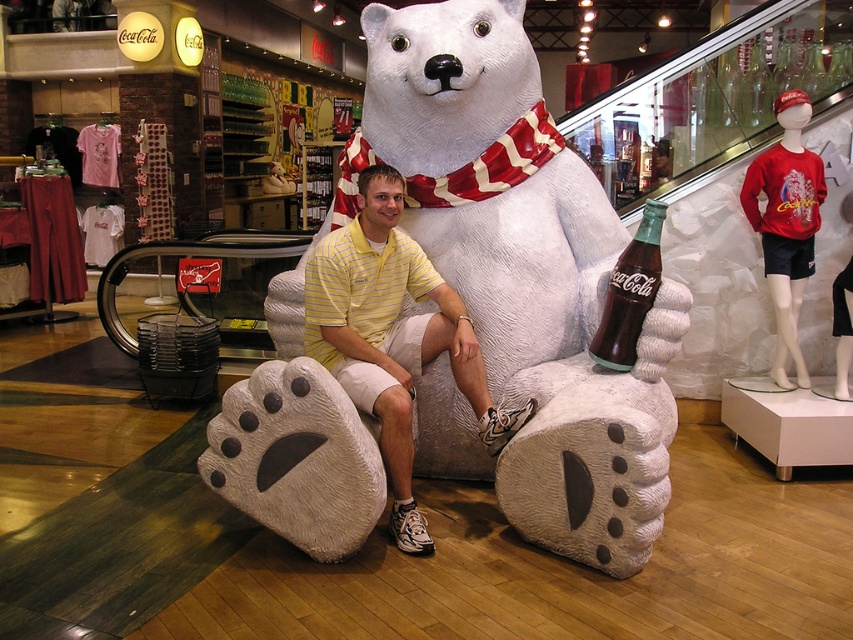
Is yellow striped shirt at center thinner than dark brown glass bottle at center?

Incorrect, yellow striped shirt at center's width is not less than dark brown glass bottle at center's.

Image resolution: width=853 pixels, height=640 pixels. Identify the location of yellow striped shirt at center. (392, 336).

Locate an element on the screen. This screenshot has width=853, height=640. yellow striped shirt at center is located at coordinates (392, 336).

Can you confirm if white plush bear at center is positioned to the right of yellow striped shirt at center?

Correct, you'll find white plush bear at center to the right of yellow striped shirt at center.

Which of these two, white plush bear at center or yellow striped shirt at center, stands shorter?

yellow striped shirt at center

Measure the distance between white plush bear at center and camera.

white plush bear at center is 8.49 feet away from camera.

Where is `white plush bear at center`? The image size is (853, 640). white plush bear at center is located at coordinates (518, 280).

Who is higher up, white plush bear at center or dark brown glass bottle at center?

white plush bear at center is above.

Find the location of `white plush bear at center`. white plush bear at center is located at coordinates click(x=518, y=280).